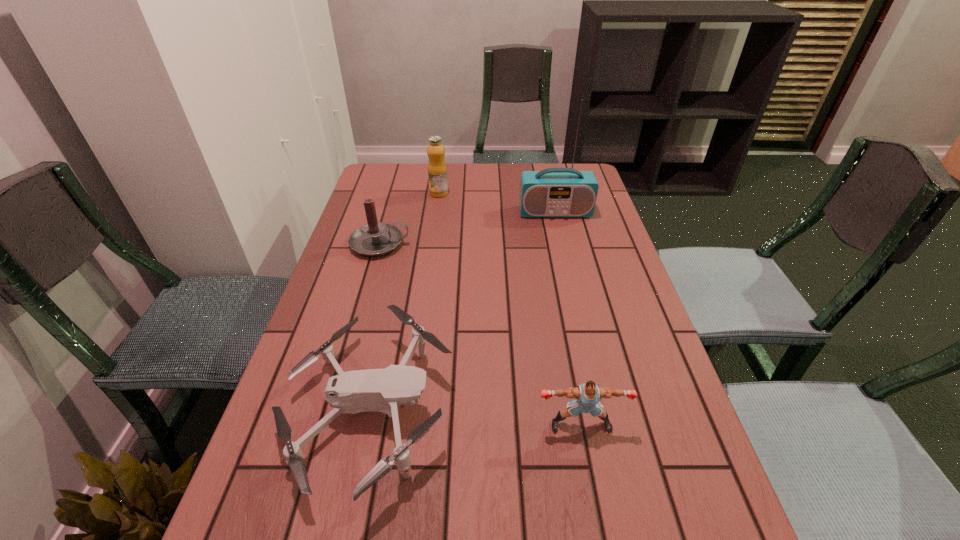
The height and width of the screenshot is (540, 960). In order to click on free space located on the front-facing side of the puncher in this screenshot , I will do `click(596, 504)`.

Where is `blank area located with a camera at the front of the shortest object`? This screenshot has width=960, height=540. blank area located with a camera at the front of the shortest object is located at coordinates (621, 413).

This screenshot has width=960, height=540. I want to click on object present at the far edge, so click(437, 170).

Locate an element on the screen. candle positioned at the left edge is located at coordinates (375, 238).

Identify the location of drone situated at the left edge. (379, 390).

Identify the location of radio receiver positioned at the right edge. The image size is (960, 540). (553, 192).

At what (x,y) coordinates should I click in order to perform the action: click on puncher located in the right edge section of the desktop. Please return your answer as a coordinate pair (x, y). The image size is (960, 540). Looking at the image, I should click on (588, 395).

Find the location of `blank space at the far edge of the desktop`. blank space at the far edge of the desktop is located at coordinates (481, 185).

Image resolution: width=960 pixels, height=540 pixels. What are the coordinates of `vacant space at the left edge of the desktop` in the screenshot? It's located at pyautogui.click(x=286, y=487).

In the image, there is a desktop. In order to click on vacant region at the right edge in this screenshot , I will do `click(606, 220)`.